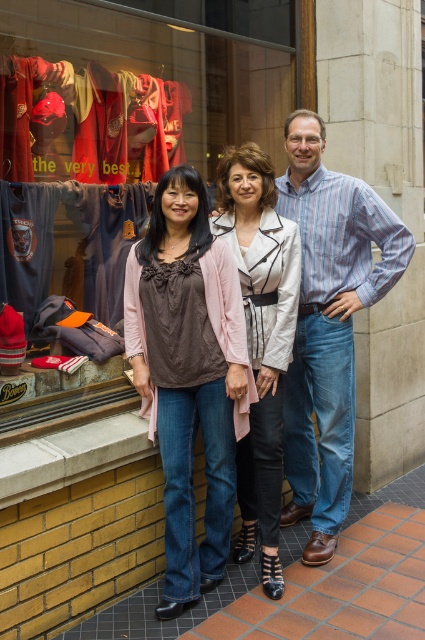
You are a photographer trying to capture a detailed shot of both the matte brown blouse at center and the matte white jacket at center displayed in the storefront window. Since you want to ensure both items are fully visible in your frame, which item requires more horizontal space in the camera viewfinder?

The matte brown blouse at center requires more horizontal space in the camera viewfinder because its width surpasses that of the matte white jacket at center.

You are a photographer trying to decide which clothing item to focus on in the storefront window. The matte brown blouse at center and the blue striped shirt at center are both in the frame. Which one is smaller and would require closer zooming to capture details?

The matte brown blouse at center is smaller than the blue striped shirt at center, so it would require closer zooming to capture details.

You are a photographer taking a picture of the blue striped shirt at center and the matte white jacket at center. Which object will appear closer to the camera in the final photo?

The blue striped shirt at center will appear closer to the camera in the final photo because the matte white jacket at center is behind it.